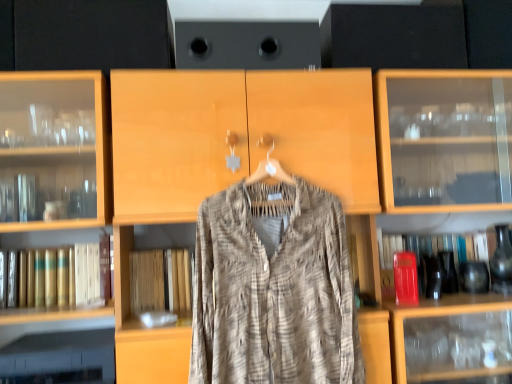
Where is `free location above gold leather book at left, the second book from the right (from a real-world perspective)`? The image size is (512, 384). free location above gold leather book at left, the second book from the right (from a real-world perspective) is located at coordinates (31, 248).